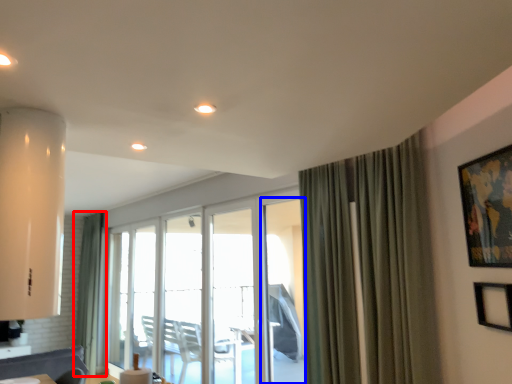
Question: Which object is closer to the camera taking this photo, curtain (highlighted by a red box) or screen door (highlighted by a blue box)?

Choices:
 (A) curtain
 (B) screen door

Answer: (B)